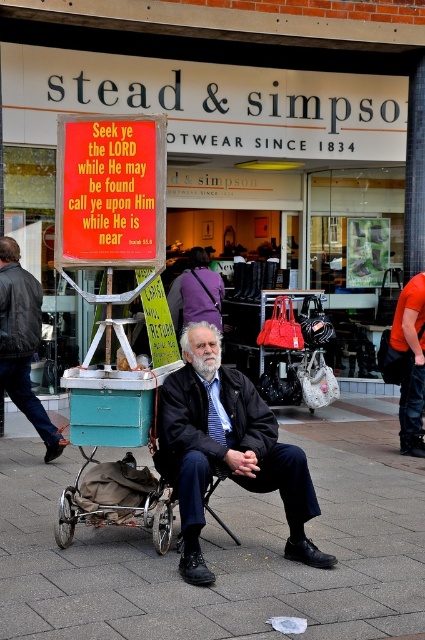
Between dark blue fabric jacket at center and metallic signboard at left, which one appears on the left side from the viewer's perspective?

From the viewer's perspective, metallic signboard at left appears more on the left side.

This screenshot has height=640, width=425. Describe the element at coordinates (226, 449) in the screenshot. I see `dark blue fabric jacket at center` at that location.

You are a GUI agent. You are given a task and a screenshot of the screen. Output one action in this format:
    pyautogui.click(x=<x>, y=<y>)
    Task: Click on the dark blue fabric jacket at center
    Image resolution: width=425 pixels, height=640 pixels.
    Given the screenshot: What is the action you would take?
    pyautogui.click(x=226, y=449)

Which of these two, matte black sign at center or orange fabric shirt at right, stands shorter?

matte black sign at center is shorter.

Image resolution: width=425 pixels, height=640 pixels. Find the location of `matte black sign at center`. matte black sign at center is located at coordinates (231, 134).

Which is in front, point (101, 70) or point (401, 336)?

Point (401, 336)

Find the location of a particular element. The height and width of the screenshot is (640, 425). matte black sign at center is located at coordinates (231, 134).

Can you confirm if paved stone pavement at center is positioned to the left of dark blue fabric jacket at center?

No, paved stone pavement at center is not to the left of dark blue fabric jacket at center.

Between point (6, 508) and point (180, 461), which one is positioned behind?

Point (6, 508)

This screenshot has width=425, height=640. Identify the location of paved stone pavement at center. (226, 547).

What are the coordinates of `paved stone pavement at center` in the screenshot? It's located at (226, 547).